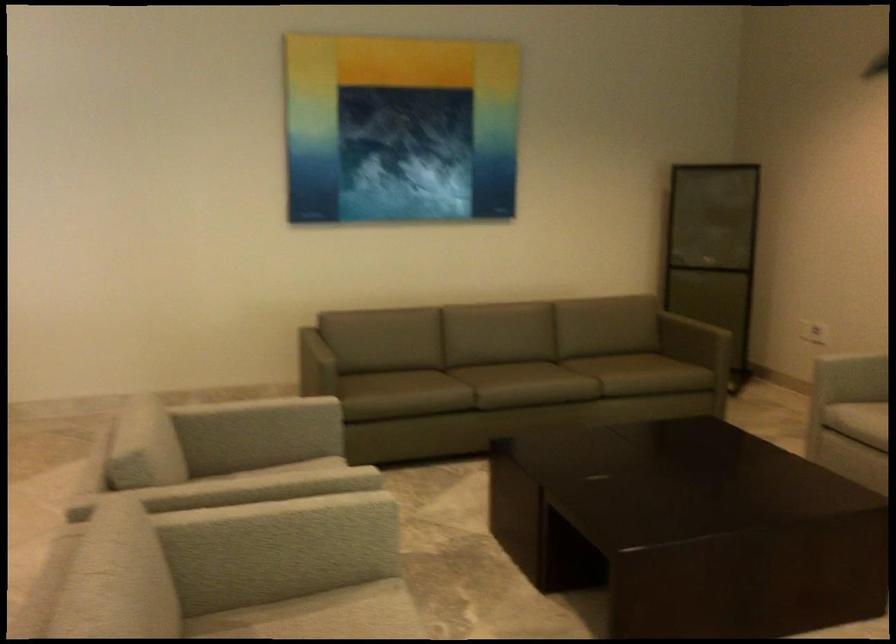
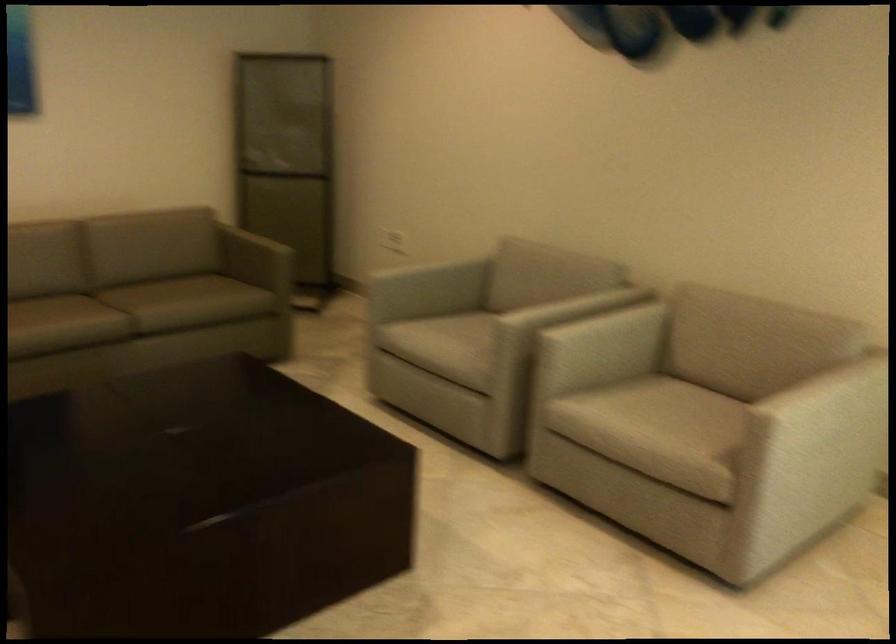
In a continuous first-person perspective shot, in which direction is the camera moving?

The movement direction of the cameraman is right, forward.